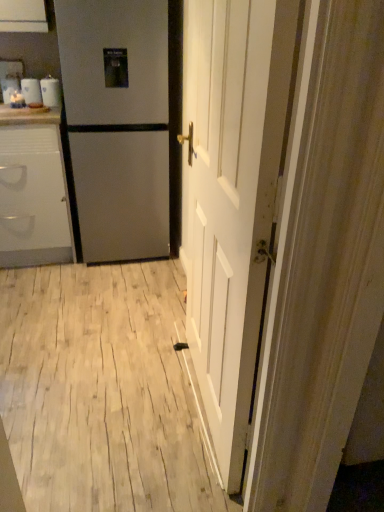
The width and height of the screenshot is (384, 512). I want to click on vacant area that is in front of satin silver refrigerator at left, so click(x=107, y=288).